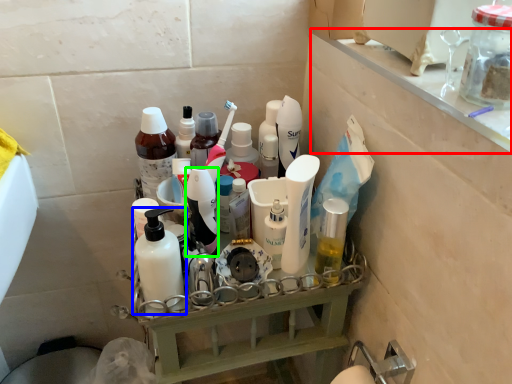
Question: Which is farther away from ledge (highlighted by a red box)? bottle (highlighted by a blue box) or toiletry (highlighted by a green box)?

Choices:
 (A) bottle
 (B) toiletry

Answer: (A)